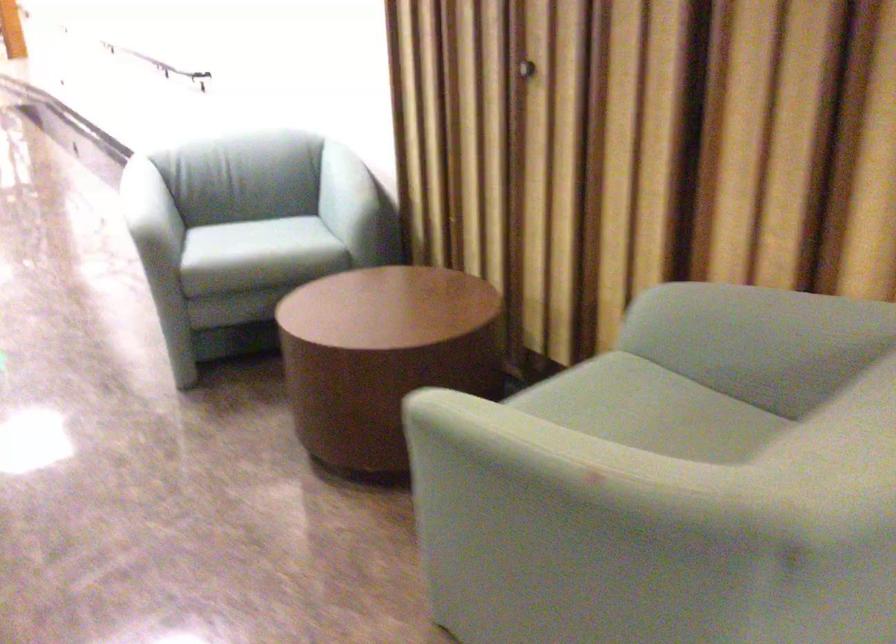
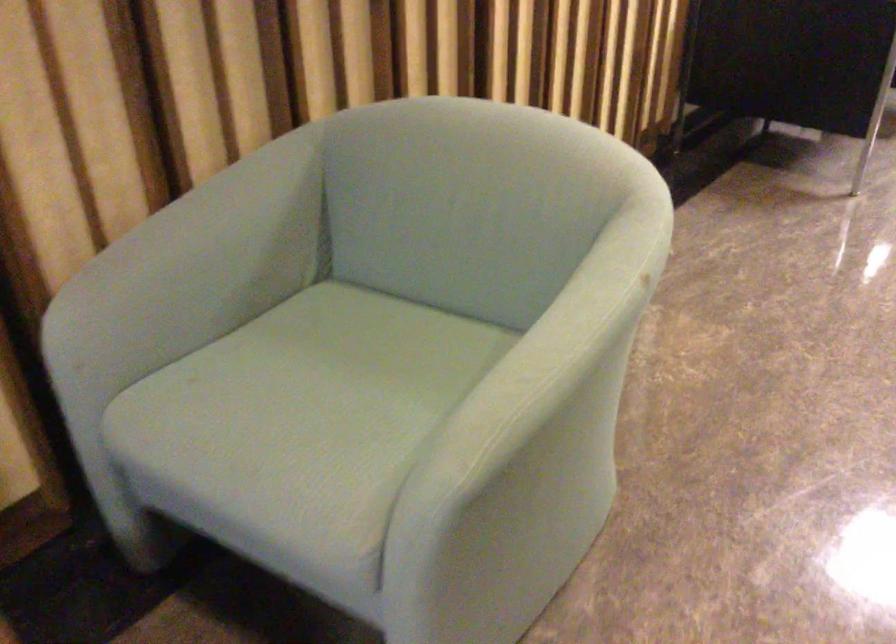
The point at (607, 410) is marked in the first image. Where is the corresponding point in the second image?

(305, 398)